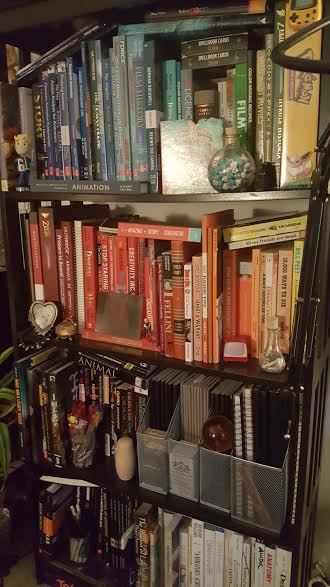
You are a GUI agent. You are given a task and a screenshot of the screen. Output one action in this format:
    pyautogui.click(x=<x>, y=<y>)
    Task: Click on the furniture
    Image resolution: width=330 pixels, height=587 pixels.
    Given the screenshot: What is the action you would take?
    pyautogui.click(x=302, y=529), pyautogui.click(x=310, y=375)